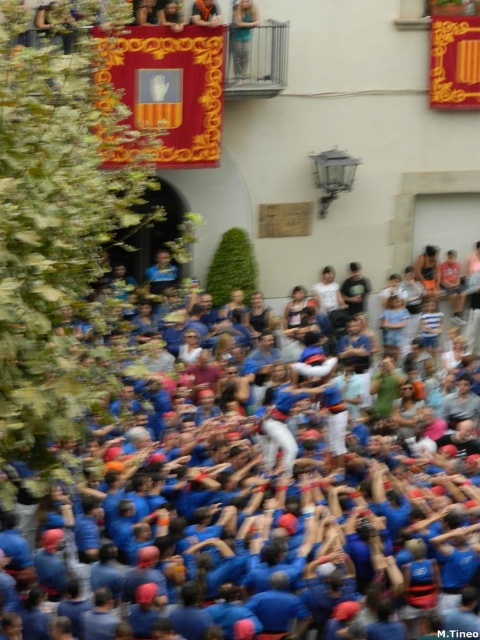
You are a photographer standing at the edge of the event. You want to capture a photo that includes both the blue fabric crowd at center and the light blue denim jeans at upper center. What is the minimum distance you need to move backward to ensure both are in frame?

The blue fabric crowd at center is 24.27 meters away from the light blue denim jeans at upper center. To capture both in the same frame, you need to move back at least 24.27 meters to ensure both are within the camera view.

You are a photographer at the event and want to capture a photo that includes both the blue fabric crowd at center and the light blue denim jeans at upper center. Which object should you focus on to ensure both are in the frame?

You should focus on the blue fabric crowd at center since it is larger than the light blue denim jeans at upper center, ensuring both can fit within the frame.